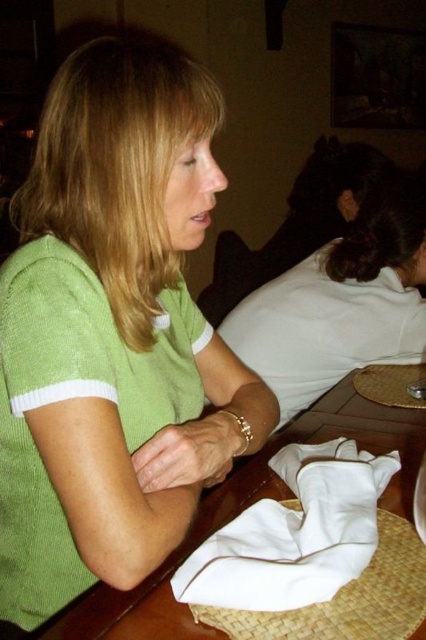
Between green knitted sweater at center and green matte shirt at center, which one is positioned higher?

green matte shirt at center

Between point (143, 513) and point (417, 355), which one is positioned behind?

Positioned behind is point (417, 355).

Where is `green knitted sweater at center`? The height and width of the screenshot is (640, 426). green knitted sweater at center is located at coordinates (112, 333).

Is point (310, 371) positioned before point (342, 492)?

No, it is not.

Is green matte shirt at center in front of white cotton napkin at lower center?

That is False.

Which is behind, point (288, 403) or point (294, 528)?

The point (288, 403) is more distant.

Locate an element on the screen. green matte shirt at center is located at coordinates (340, 301).

Image resolution: width=426 pixels, height=640 pixels. I want to click on green knitted sweater at center, so click(112, 333).

Does green knitted sweater at center appear under white cotton napkin at lower center?

Actually, green knitted sweater at center is above white cotton napkin at lower center.

From the picture: Who is more forward, (213, 422) or (285, 600)?

Point (285, 600) is in front.

The image size is (426, 640). I want to click on green knitted sweater at center, so click(x=112, y=333).